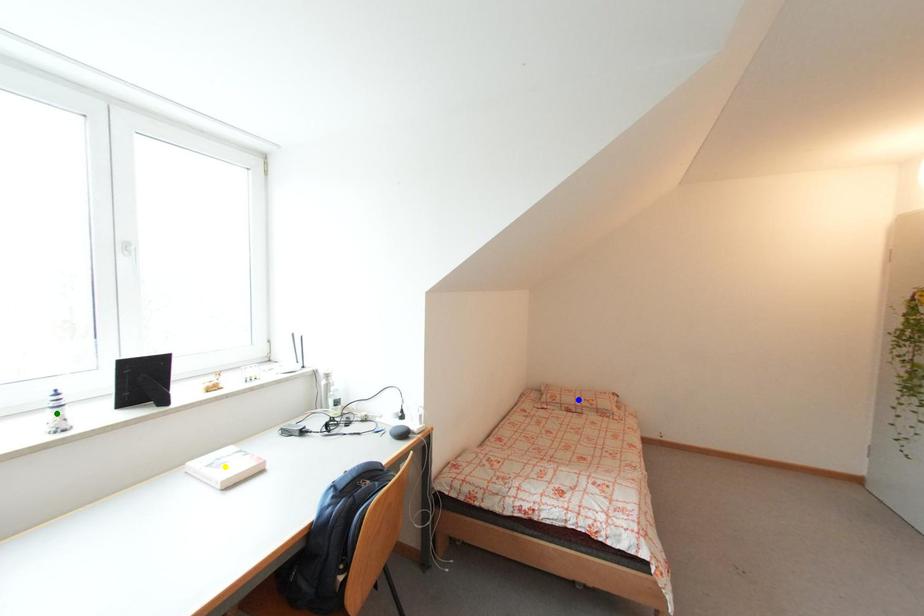
Order these from nearest to farthest:
blue point
green point
yellow point

green point
yellow point
blue point